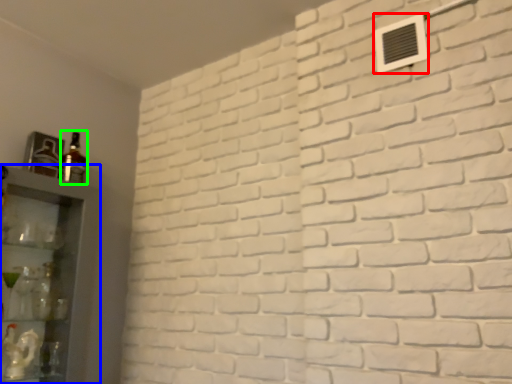
Question: Estimate the real-world distances between objects in this image. Which object is farther from air conditioning (highlighted by a red box), shelf (highlighted by a blue box) or bottle (highlighted by a green box)?

Choices:
 (A) shelf
 (B) bottle

Answer: (A)